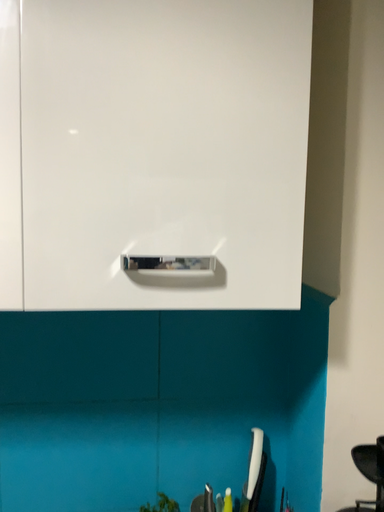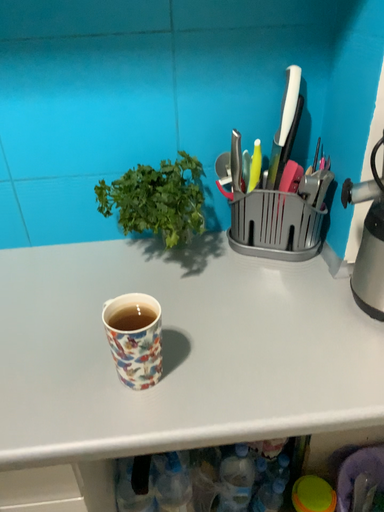
Question: How did the camera likely rotate when shooting the video?

Choices:
 (A) rotated upward
 (B) rotated downward

Answer: (B)